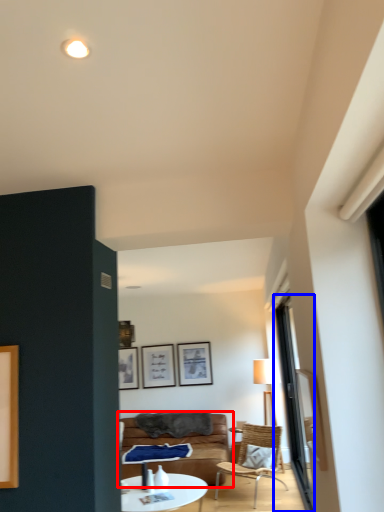
Question: Among these objects, which one is farthest to the camera, studio couch (highlighted by a red box) or window (highlighted by a blue box)?

Choices:
 (A) studio couch
 (B) window

Answer: (A)